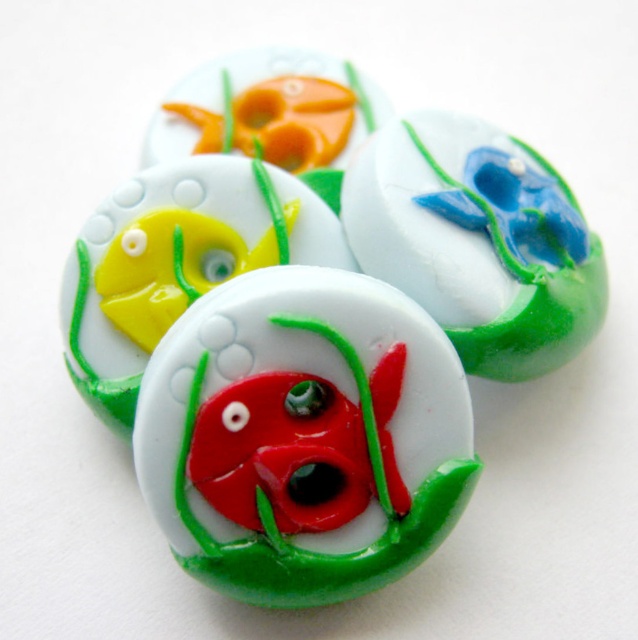
Question: Based on their relative distances, which object is farther from the matte glass flower at upper right?

Choices:
 (A) matte glass fish at center
 (B) matte orange fish at upper center

Answer: (A)

Question: Which of the following is the closest to the observer?

Choices:
 (A) (107, 420)
 (B) (142, 420)

Answer: (B)

Question: Which point is closer to the camera?

Choices:
 (A) matte glass flower at upper right
 (B) matte glass fish at center
 (C) matte orange fish at upper center

Answer: (B)

Question: Is glossy ceramic fish at center above matte orange fish at upper center?

Choices:
 (A) yes
 (B) no

Answer: (B)

Question: In this image, where is glossy ceramic fish at center located relative to matte glass fish at center?

Choices:
 (A) left
 (B) right

Answer: (B)

Question: Is glossy ceramic fish at center smaller than matte orange fish at upper center?

Choices:
 (A) yes
 (B) no

Answer: (B)